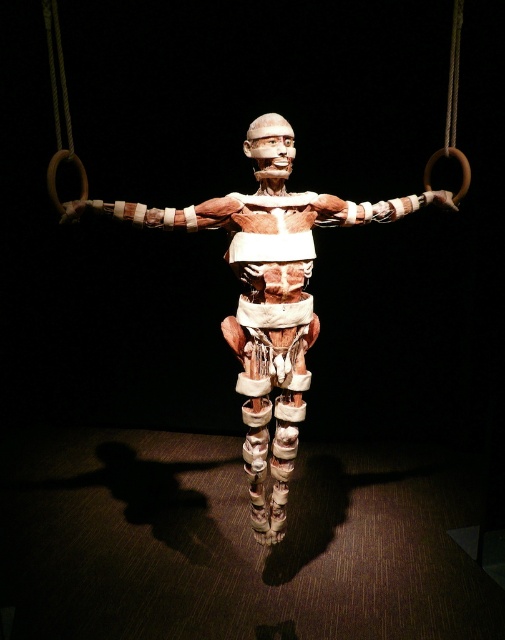
You are an anatomist analyzing the anatomical model in the image. You notice two points marked as point 1 at coordinates point (275, 148) and point 2 at coordinates point (54, 179). From your perspective, which point is closer to you?

Point (54, 179) is closer to you because the description states that point (275, 148) is behind point (54, 179).

You are an artist preparing to sketch the anatomical model and the wooden rings. You notice that the matte brown anatomical model at center and the wooden rings at upper center have different widths. Which object has a smaller width?

The matte brown anatomical model at center has a lesser width compared to wooden rings at upper center, so the matte brown anatomical model at center is smaller in width.

You are an artist trying to sketch the scene. You notice the matte brown anatomical model at center and the wooden rings at upper center. Which object is closer to you, the viewer?

The matte brown anatomical model at center is closer to you because the wooden rings at upper center are positioned behind it.